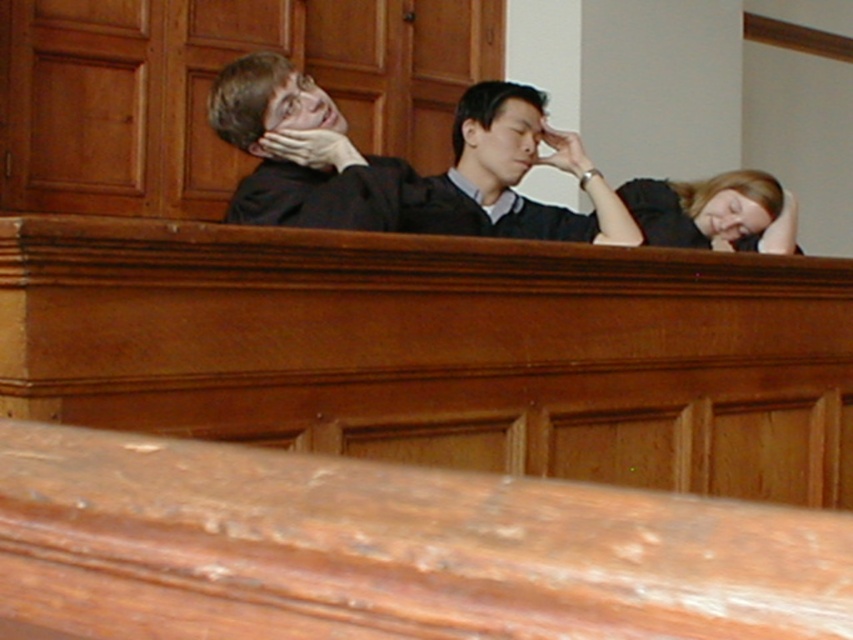
Between matte black suit at upper left and black matte shirt at center, which one is positioned lower?

matte black suit at upper left

Does matte black suit at upper left have a smaller size compared to black matte shirt at center?

Yes, matte black suit at upper left is smaller than black matte shirt at center.

The width and height of the screenshot is (853, 640). In order to click on matte black suit at upper left in this screenshot , I will do `click(299, 152)`.

Identify the location of matte black suit at upper left. This screenshot has height=640, width=853. (299, 152).

Can you confirm if black matte shirt at center is smaller than blonde hair at upper right?

Actually, black matte shirt at center might be larger than blonde hair at upper right.

Where is `black matte shirt at center`? black matte shirt at center is located at coordinates (515, 177).

The height and width of the screenshot is (640, 853). What are the coordinates of `black matte shirt at center` in the screenshot? It's located at (515, 177).

Is point (524, 147) positioned behind point (529, 122)?

No, (524, 147) is closer to viewer.

Image resolution: width=853 pixels, height=640 pixels. What do you see at coordinates (515, 177) in the screenshot?
I see `black matte shirt at center` at bounding box center [515, 177].

The height and width of the screenshot is (640, 853). Find the location of `black matte shirt at center`. black matte shirt at center is located at coordinates (515, 177).